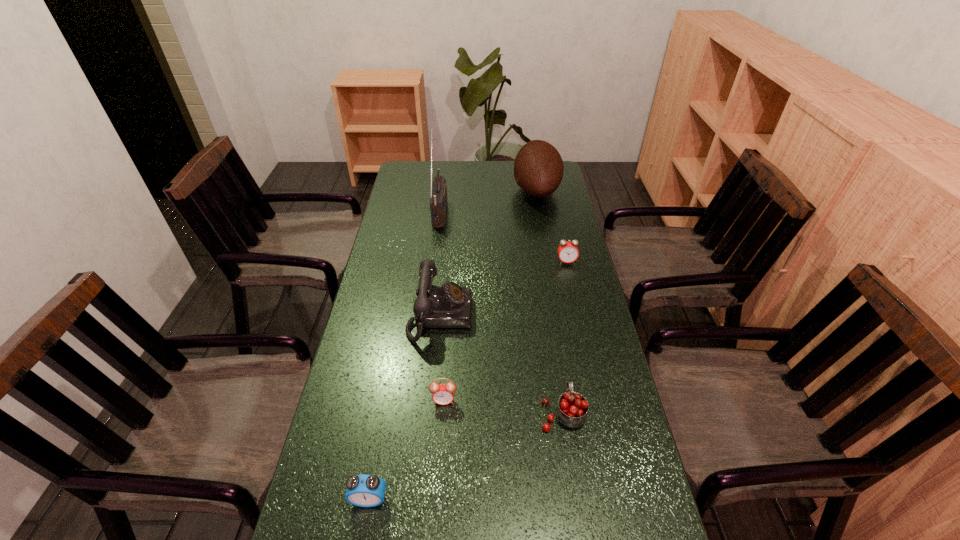
This screenshot has width=960, height=540. I want to click on object positioned at the far edge, so click(538, 168).

Where is `telephone that is at the left edge`? The image size is (960, 540). telephone that is at the left edge is located at coordinates (449, 306).

Where is `alarm clock located at the left edge`? alarm clock located at the left edge is located at coordinates (364, 490).

You are a GUI agent. You are given a task and a screenshot of the screen. Output one action in this format:
    pyautogui.click(x=<x>, y=<y>)
    Task: Click on the football that is positioned at the right edge
    
    Given the screenshot: What is the action you would take?
    pyautogui.click(x=538, y=168)

Locate an element on the screen. Image resolution: width=960 pixels, height=540 pixels. cherry present at the right edge is located at coordinates (572, 408).

Find the location of a particular element. The height and width of the screenshot is (540, 960). alarm clock situated at the right edge is located at coordinates point(568,252).

This screenshot has height=540, width=960. In order to click on object situated at the far right corner in this screenshot , I will do `click(538, 168)`.

In the image, there is a desktop. Identify the location of vacant space at the far edge. The image size is (960, 540). (480, 177).

I want to click on free spot at the left edge of the desktop, so (413, 241).

At what (x,y) coordinates should I click in order to perform the action: click on free region at the right edge. Please return your answer as a coordinate pair (x, y). The width and height of the screenshot is (960, 540). Looking at the image, I should click on (555, 229).